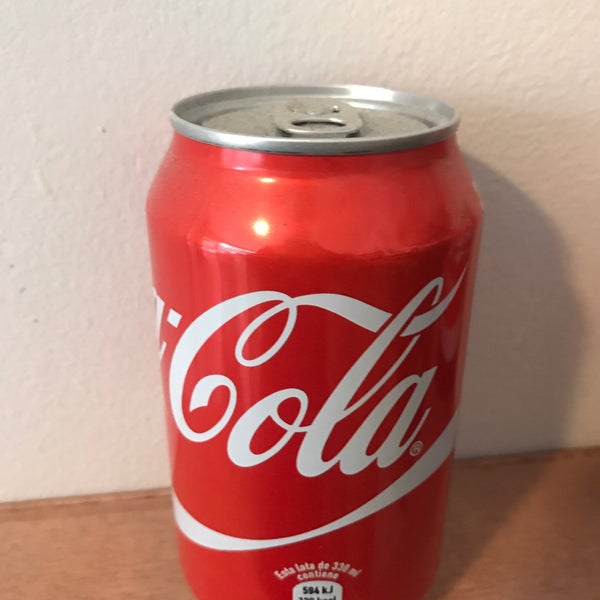
The height and width of the screenshot is (600, 600). Find the location of `white wall`. white wall is located at coordinates (35, 187).